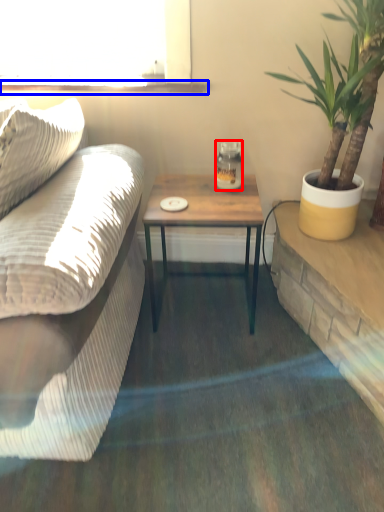
Question: Which object is further to the camera taking this photo, coffee cup (highlighted by a red box) or window sill (highlighted by a blue box)?

Choices:
 (A) coffee cup
 (B) window sill

Answer: (B)